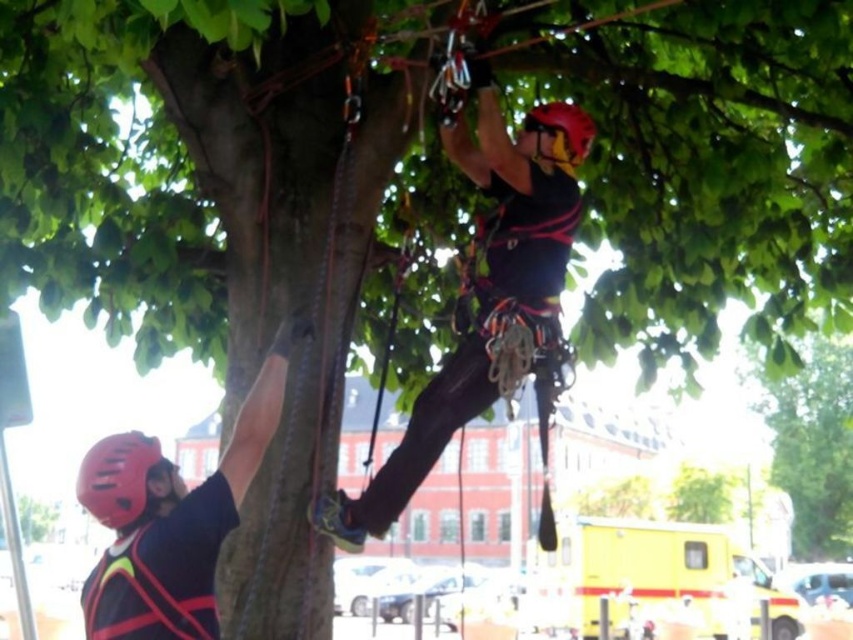
In the scene shown: Can you confirm if matte black helmet at upper center is smaller than green leafy tree at upper center?

Correct, matte black helmet at upper center occupies less space than green leafy tree at upper center.

Between point (399, 512) and point (766, 397), which one is positioned behind?

Point (766, 397)

The height and width of the screenshot is (640, 853). What do you see at coordinates (479, 307) in the screenshot? I see `matte black helmet at upper center` at bounding box center [479, 307].

Where is `matte black helmet at upper center`? This screenshot has height=640, width=853. matte black helmet at upper center is located at coordinates (479, 307).

Does red matte safety vest at lower left appear under matte black helmet at lower left?

Yes.

Which is above, red matte safety vest at lower left or matte black helmet at lower left?

Positioned higher is matte black helmet at lower left.

The image size is (853, 640). Describe the element at coordinates (155, 584) in the screenshot. I see `red matte safety vest at lower left` at that location.

You are a GUI agent. You are given a task and a screenshot of the screen. Output one action in this format:
    pyautogui.click(x=<x>, y=<y>)
    Task: Click on the red matte safety vest at lower left
    
    Given the screenshot: What is the action you would take?
    pyautogui.click(x=155, y=584)

Does matte black helmet at upper center appear under red matte safety vest at lower left?

Actually, matte black helmet at upper center is above red matte safety vest at lower left.

Can you confirm if matte black helmet at upper center is bigger than red matte safety vest at lower left?

Yes, matte black helmet at upper center is bigger than red matte safety vest at lower left.

Is point (442, 449) behind point (187, 609)?

Yes.

At what (x,y) coordinates should I click in order to perform the action: click on matte black helmet at upper center. Please return your answer as a coordinate pair (x, y). The height and width of the screenshot is (640, 853). Looking at the image, I should click on (479, 307).